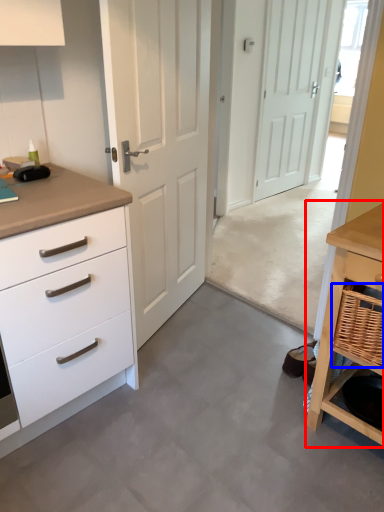
Question: Which object is closer to the camera taking this photo, table (highlighted by a red box) or basket (highlighted by a blue box)?

Choices:
 (A) table
 (B) basket

Answer: (A)